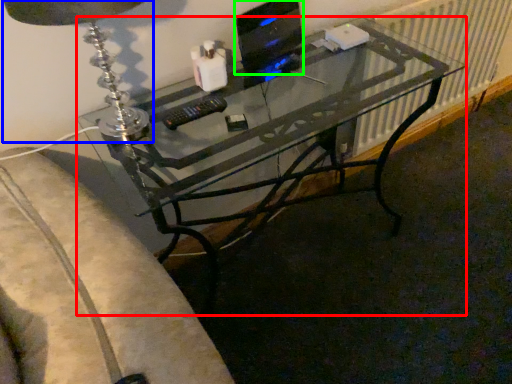
Question: Based on their relative distances, which object is farther from desk (highlighted by a red box)? Choose from table lamp (highlighted by a blue box) and computer monitor (highlighted by a green box).

Choices:
 (A) table lamp
 (B) computer monitor

Answer: (A)